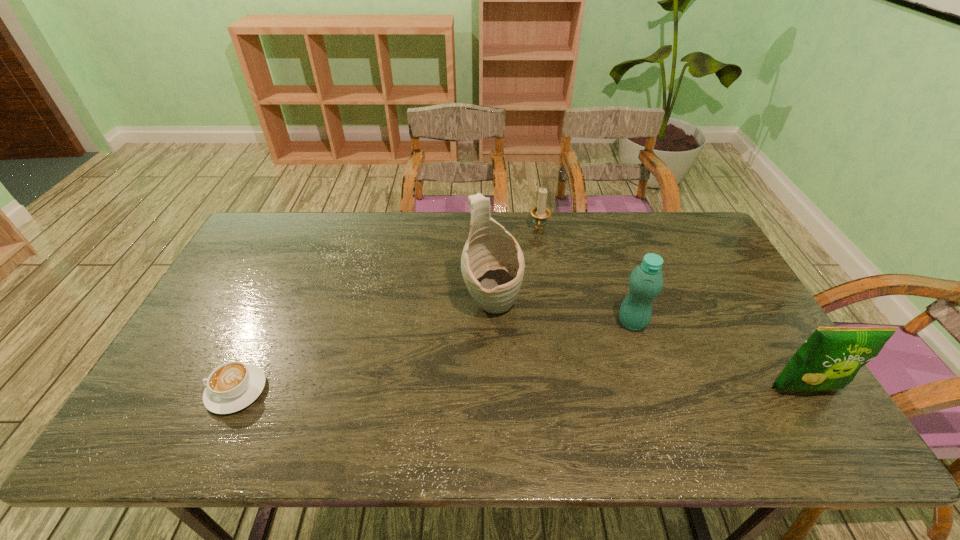
Where is `vacant region between the water bottle and the candle_holder`? This screenshot has width=960, height=540. vacant region between the water bottle and the candle_holder is located at coordinates (586, 276).

At what (x,y) coordinates should I click in order to perform the action: click on free space between the fourth tallest object and the water bottle. Please return your answer as a coordinate pair (x, y). This screenshot has height=540, width=960. Looking at the image, I should click on (586, 276).

Where is `vacant area between the fourth object from left to right and the rightmost object`? Image resolution: width=960 pixels, height=540 pixels. vacant area between the fourth object from left to right and the rightmost object is located at coordinates (718, 356).

Where is `object that stands as the third closest to the crisp (potato chip)`? object that stands as the third closest to the crisp (potato chip) is located at coordinates (540, 213).

Choose which object is the third nearest neighbor to the tallest object. Please provide its 2D coordinates. Your answer should be formatted as a tuple, i.e. [(x, y)], where the tuple contains the x and y coordinates of a point satisfying the conditions above.

[(232, 386)]